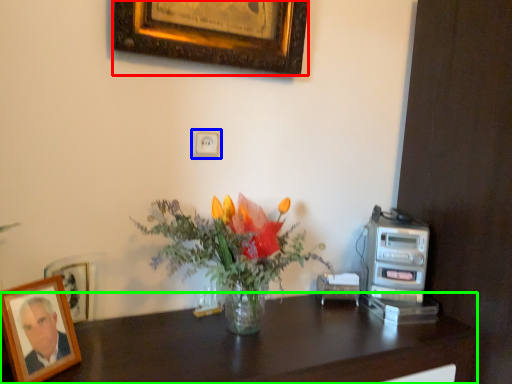
Question: Which object is positioned closest to picture frame (highlighted by a red box)? Select from electric outlet (highlighted by a blue box) and desk (highlighted by a green box).

Choices:
 (A) electric outlet
 (B) desk

Answer: (A)